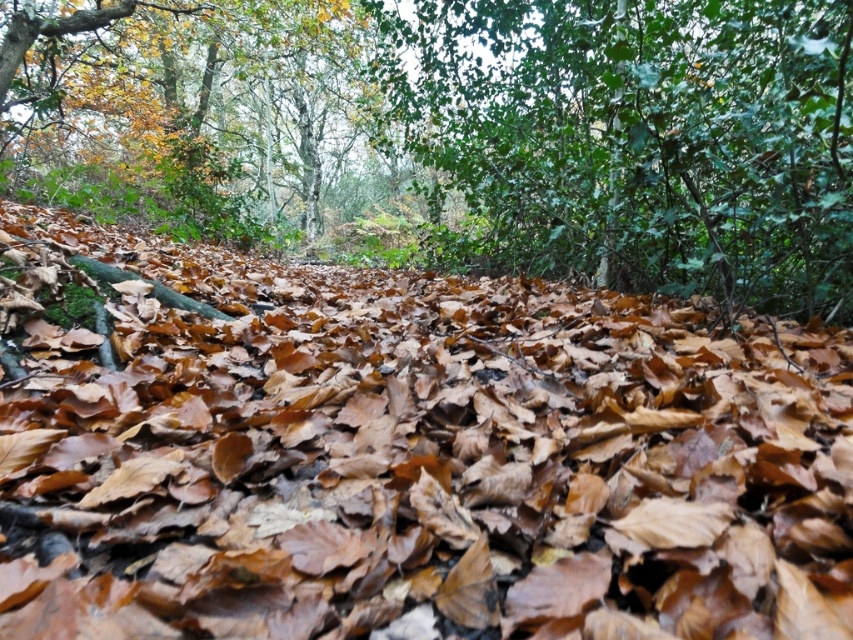
Can you confirm if brown leaf litter at center is thinner than green glossy leaves at upper center?

No.

Can you confirm if brown leaf litter at center is smaller than green glossy leaves at upper center?

Incorrect, brown leaf litter at center is not smaller in size than green glossy leaves at upper center.

Is point (850, 349) less distant than point (590, 189)?

Yes, it is in front of point (590, 189).

The width and height of the screenshot is (853, 640). What are the coordinates of `brown leaf litter at center` in the screenshot? It's located at tap(409, 456).